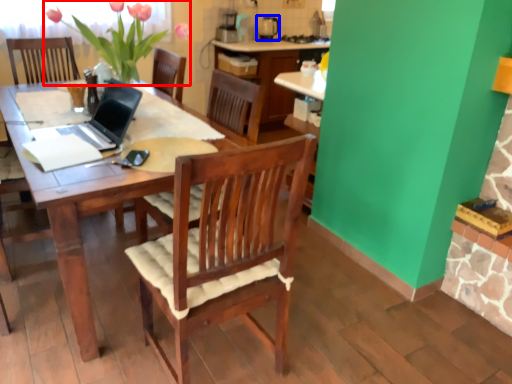
Question: Which of the following is the closest to the observer, floral arrangement (highlighted by a red box) or appliance (highlighted by a blue box)?

Choices:
 (A) floral arrangement
 (B) appliance

Answer: (A)